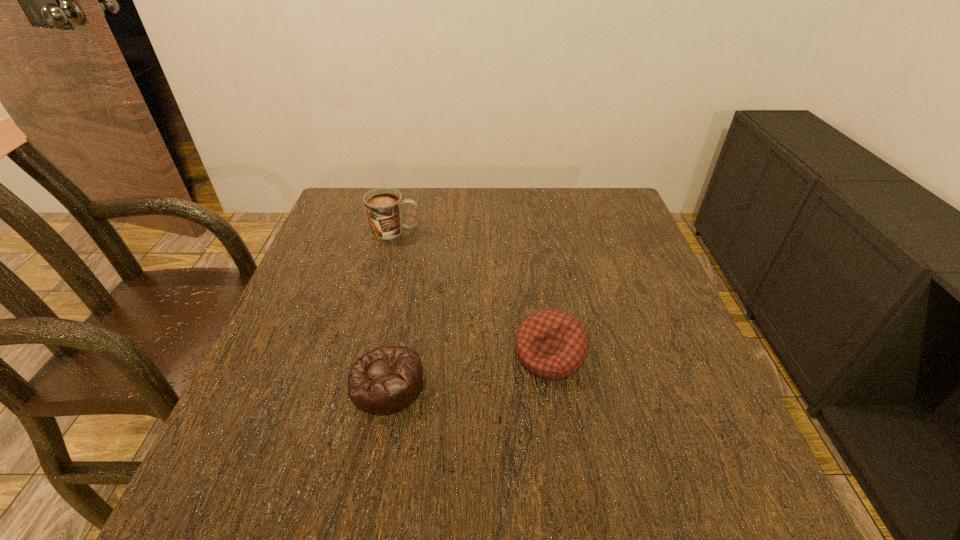
At what (x,y) coordinates should I click in order to perform the action: click on vacant area that satisfies the following two spatial constraints: 1. on the side of the shorter beanbag with the handle; 2. on the right side of the farthest object. Please return your answer as a coordinate pair (x, y). Looking at the image, I should click on (x=358, y=384).

Locate an element on the screen. This screenshot has height=540, width=960. vacant region that satisfies the following two spatial constraints: 1. on the side of the tallest object with the handle; 2. on the left side of the shortest object is located at coordinates (358, 384).

At what (x,y) coordinates should I click in order to perform the action: click on free spot that satisfies the following two spatial constraints: 1. on the side of the right beanbag with the handle; 2. on the right side of the farthest object. Please return your answer as a coordinate pair (x, y). The height and width of the screenshot is (540, 960). Looking at the image, I should click on (366, 355).

Where is `vacant space that satisfies the following two spatial constraints: 1. on the side of the farthest object with the handle; 2. on the left side of the second shortest object`? This screenshot has height=540, width=960. vacant space that satisfies the following two spatial constraints: 1. on the side of the farthest object with the handle; 2. on the left side of the second shortest object is located at coordinates (366, 355).

The height and width of the screenshot is (540, 960). I want to click on free space that satisfies the following two spatial constraints: 1. on the side of the right beanbag with the handle; 2. on the right side of the mug, so click(x=366, y=355).

Find the location of a particular element. vacant area in the image that satisfies the following two spatial constraints: 1. on the side of the tallest object with the handle; 2. on the left side of the second shortest object is located at coordinates (366, 355).

Find the location of a particular element. The width and height of the screenshot is (960, 540). vacant point that satisfies the following two spatial constraints: 1. on the back side of the taller beanbag; 2. on the side of the farthest object with the handle is located at coordinates (531, 231).

Where is `free space in the image that satisfies the following two spatial constraints: 1. on the side of the tallest object with the handle; 2. on the right side of the left beanbag`? Image resolution: width=960 pixels, height=540 pixels. free space in the image that satisfies the following two spatial constraints: 1. on the side of the tallest object with the handle; 2. on the right side of the left beanbag is located at coordinates (358, 384).

Locate an element on the screen. free space in the image that satisfies the following two spatial constraints: 1. on the side of the mug with the handle; 2. on the back side of the right beanbag is located at coordinates (366, 355).

Where is `vacant space that satisfies the following two spatial constraints: 1. on the side of the tallest object with the handle; 2. on the right side of the right beanbag`? The height and width of the screenshot is (540, 960). vacant space that satisfies the following two spatial constraints: 1. on the side of the tallest object with the handle; 2. on the right side of the right beanbag is located at coordinates (366, 355).